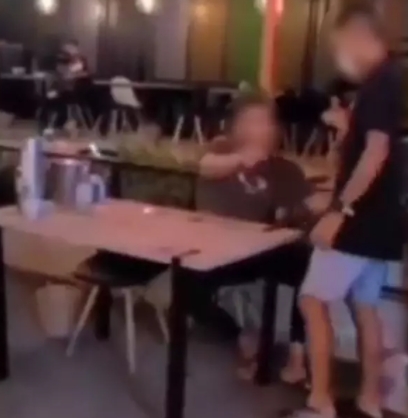
Locate an element on the screen. This screenshot has width=408, height=418. black chairs is located at coordinates (115, 271), (187, 107), (93, 98), (285, 112), (317, 113).